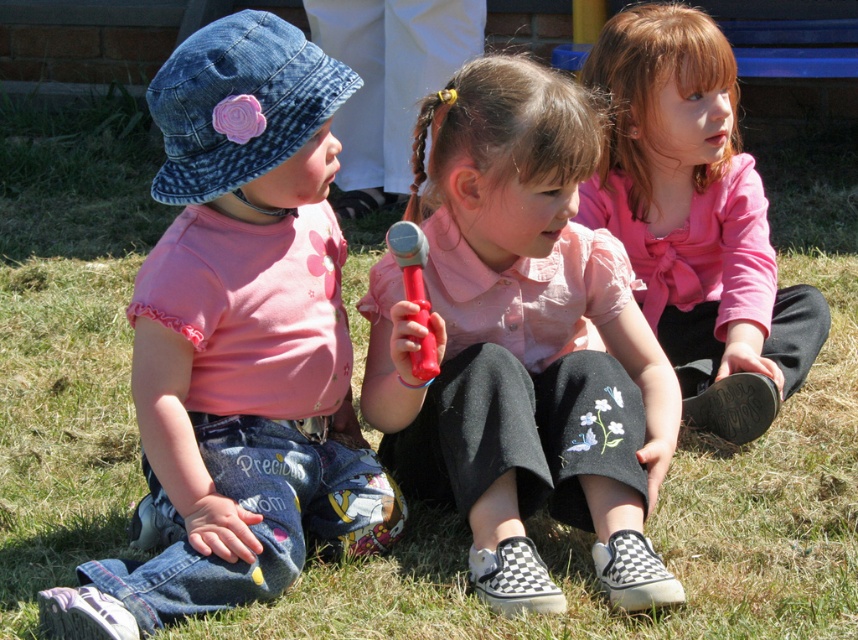
In the scene shown: Who is lower down, pink fabric shirt at center or pink satin blouse at center?

pink fabric shirt at center

Which is above, pink fabric shirt at center or pink satin blouse at center?

pink satin blouse at center is above.

Between point (462, 436) and point (698, 300), which one is positioned in front?

Point (462, 436) is in front.

Where is `pink fabric shirt at center`? The height and width of the screenshot is (640, 858). pink fabric shirt at center is located at coordinates (524, 344).

Between denim hat at left and pink fabric shirt at center, which one appears on the left side from the viewer's perspective?

Positioned to the left is denim hat at left.

Between point (213, 193) and point (521, 387), which one is positioned in front?

Positioned in front is point (213, 193).

Who is more forward, (x=212, y=522) or (x=587, y=456)?

Point (x=212, y=522) is more forward.

You are a GUI agent. You are given a task and a screenshot of the screen. Output one action in this format:
    pyautogui.click(x=<x>, y=<y>)
    Task: Click on the denim hat at left
    Image resolution: width=858 pixels, height=640 pixels.
    Given the screenshot: What is the action you would take?
    tap(239, 344)

Consider the image. Between pink fabric shirt at center and red plastic hammer at center, which one appears on the left side from the viewer's perspective?

Positioned to the left is red plastic hammer at center.

The width and height of the screenshot is (858, 640). I want to click on pink fabric shirt at center, so click(524, 344).

Is point (541, 76) positioned in front of point (423, 256)?

No.

The image size is (858, 640). I want to click on pink fabric shirt at center, so click(x=524, y=344).